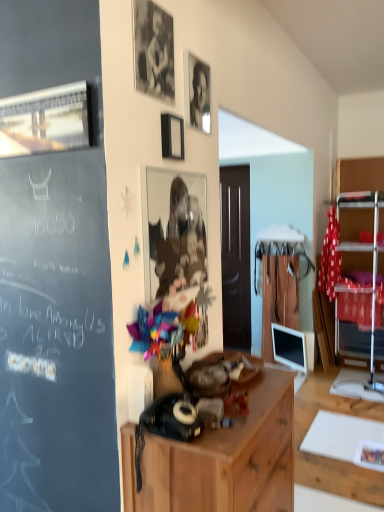
Question: From a real-world perspective, is black glossy photo frame at upper center under metallic silver picture frame at upper left, which is counted as the third picture frame, starting from the top?

Choices:
 (A) yes
 (B) no

Answer: (B)

Question: Is black glossy photo frame at upper center with metallic silver picture frame at upper left, which is counted as the third picture frame, starting from the top?

Choices:
 (A) yes
 (B) no

Answer: (B)

Question: Is black glossy photo frame at upper center positioned in front of metallic silver picture frame at upper left, the first picture frame positioned from the left?

Choices:
 (A) yes
 (B) no

Answer: (B)

Question: Does black glossy photo frame at upper center have a smaller size compared to metallic silver picture frame at upper left, which is counted as the third picture frame, starting from the top?

Choices:
 (A) yes
 (B) no

Answer: (A)

Question: Is black glossy photo frame at upper center oriented towards metallic silver picture frame at upper left, which is counted as the third picture frame, starting from the top?

Choices:
 (A) yes
 (B) no

Answer: (B)

Question: Choose the correct answer: Is metallic silver picture frame at upper left, which is counted as the fourth picture frame, starting from the right, inside black glossy photo frame at upper center or outside it?

Choices:
 (A) outside
 (B) inside

Answer: (A)

Question: Visually, is metallic silver picture frame at upper left, which appears as the second picture frame when ordered from the bottom, positioned to the left or to the right of black glossy photo frame at upper center?

Choices:
 (A) right
 (B) left

Answer: (B)

Question: Is metallic silver picture frame at upper left, the first picture frame positioned from the left, in front of or behind black glossy photo frame at upper center in the image?

Choices:
 (A) front
 (B) behind

Answer: (A)

Question: Does point (44, 139) appear closer or farther from the camera than point (196, 74)?

Choices:
 (A) closer
 (B) farther

Answer: (A)

Question: From a real-world perspective, is metallic silver picture frame at upper left, the first picture frame positioned from the left, above or below metallic silver shelf at right?

Choices:
 (A) above
 (B) below

Answer: (A)

Question: In the image, is metallic silver picture frame at upper left, which is counted as the third picture frame, starting from the top, positioned in front of or behind metallic silver shelf at right?

Choices:
 (A) behind
 (B) front

Answer: (B)

Question: Considering the relative positions of metallic silver picture frame at upper left, which is counted as the third picture frame, starting from the top, and metallic silver shelf at right in the image provided, is metallic silver picture frame at upper left, which is counted as the third picture frame, starting from the top, to the left or to the right of metallic silver shelf at right?

Choices:
 (A) right
 (B) left

Answer: (B)

Question: In terms of width, does metallic silver picture frame at upper left, the first picture frame positioned from the left, look wider or thinner when compared to metallic silver shelf at right?

Choices:
 (A) thin
 (B) wide

Answer: (A)

Question: Considering the positions of point (365, 245) and point (187, 245), is point (365, 245) closer or farther from the camera than point (187, 245)?

Choices:
 (A) closer
 (B) farther

Answer: (B)

Question: Would you say metallic silver shelf at right is inside or outside metallic reflective photo frame at center, which is the 1th picture frame from right to left?

Choices:
 (A) inside
 (B) outside

Answer: (B)